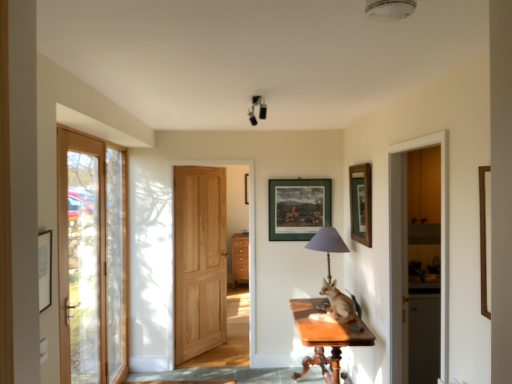
Question: Does point (316, 375) appear closer or farther from the camera than point (67, 354)?

Choices:
 (A) farther
 (B) closer

Answer: (A)

Question: From the image's perspective, is smooth stone path at lower center above or below clear glass door at left, the first door in the front-to-back sequence?

Choices:
 (A) below
 (B) above

Answer: (A)

Question: Which is farther from the natural wood door at center, which is counted as the second door, starting from the front?

Choices:
 (A) wooden table at center
 (B) light brown fur at center
 (C) wooden picture frame at upper right, positioned as the 1th picture frame in front-to-back order
 (D) clear glass door at left, the second door viewed from the right
 (E) smooth stone path at lower center

Answer: (A)

Question: Which is nearer to the green matte picture frame at center, marked as the 2th picture frame in a front-to-back arrangement?

Choices:
 (A) natural wood door at center, the second door viewed from the left
 (B) wooden picture frame at upper right, which is the 2th picture frame in back-to-front order
 (C) wooden table at center
 (D) black matte lamp at upper center
 (E) light brown fur at center

Answer: (B)